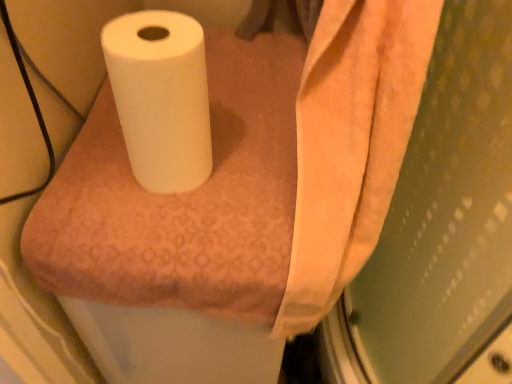
You are a GUI agent. You are given a task and a screenshot of the screen. Output one action in this format:
    pyautogui.click(x=<x>, y=<y>)
    Task: Click on the vacant area that lies to the right of white matte toilet paper at center
    
    Given the screenshot: What is the action you would take?
    tap(257, 169)